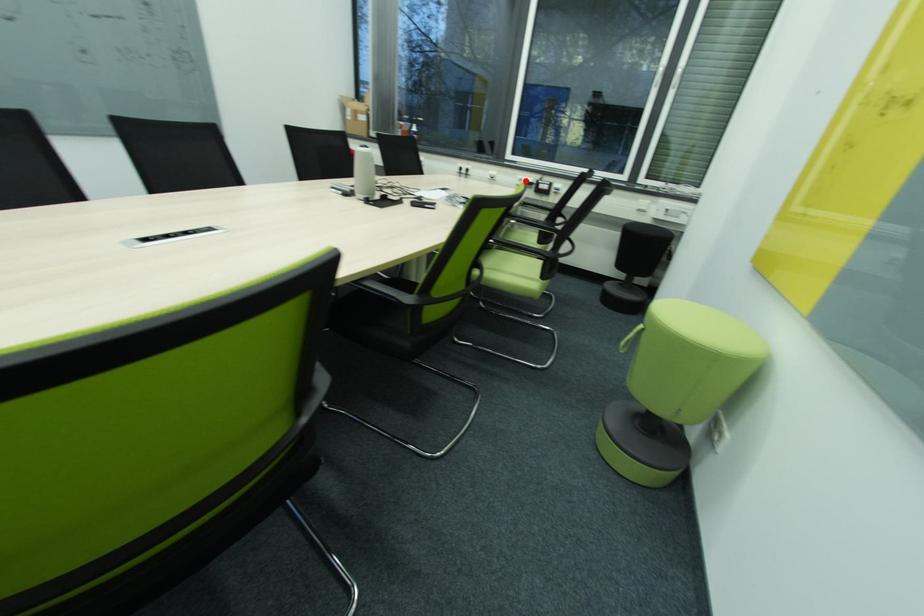
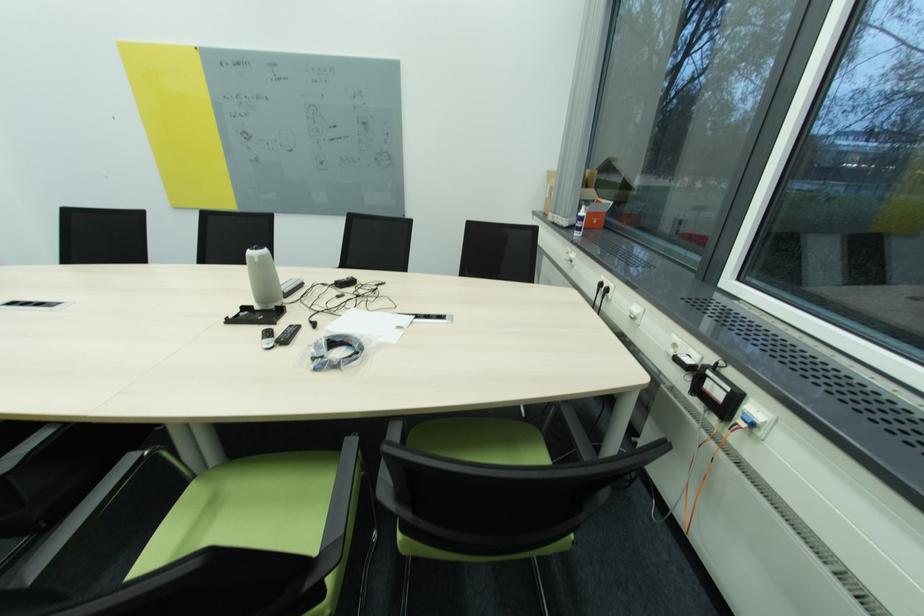
Where in the second image is the point corresponding to the highlighted location from the first image?

(679, 346)